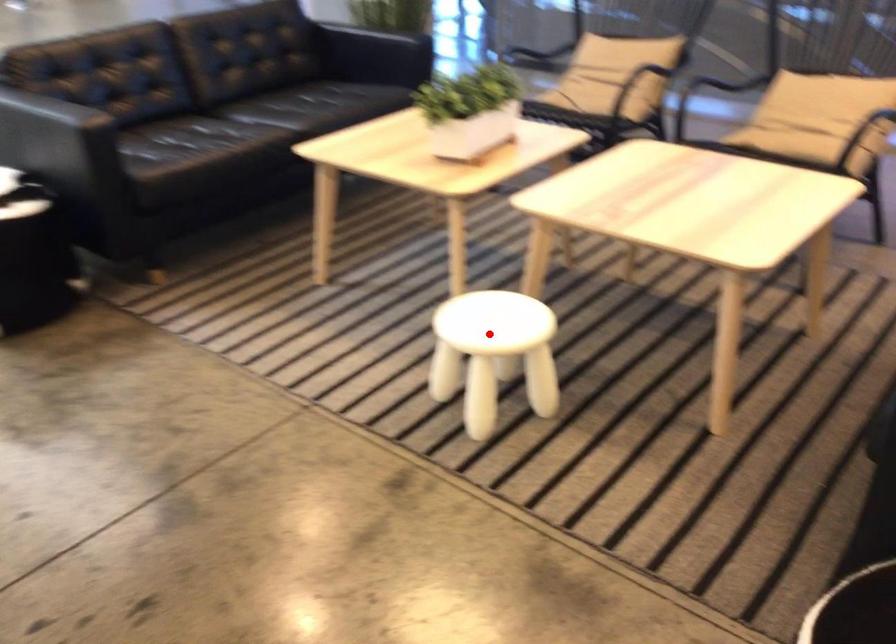
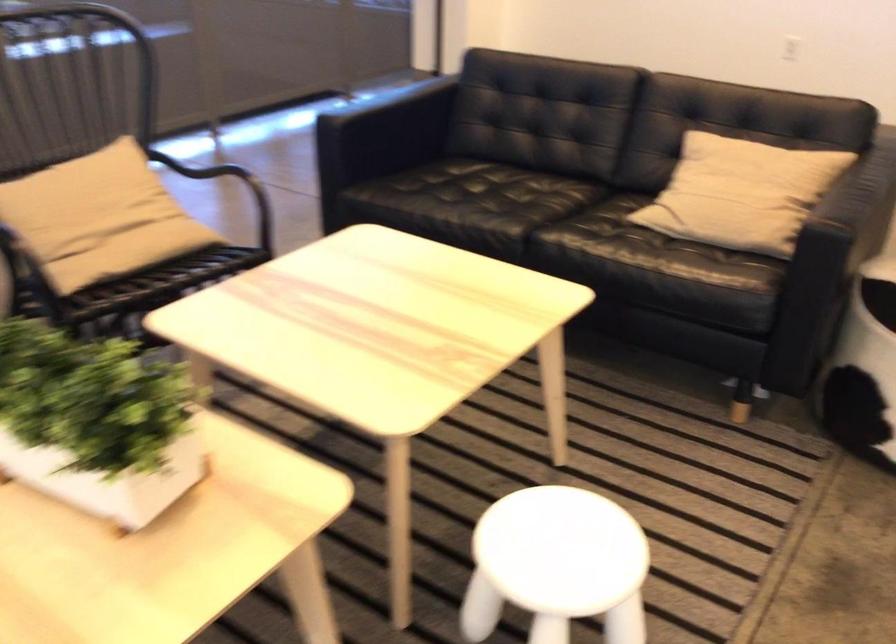
Question: I am providing you with two images of the same scene from different viewpoints. In image1, a red point is highlighted. Considering the same 3D point in image2, which of the following is correct?

Choices:
 (A) It is closer
 (B) It is farther

Answer: (A)